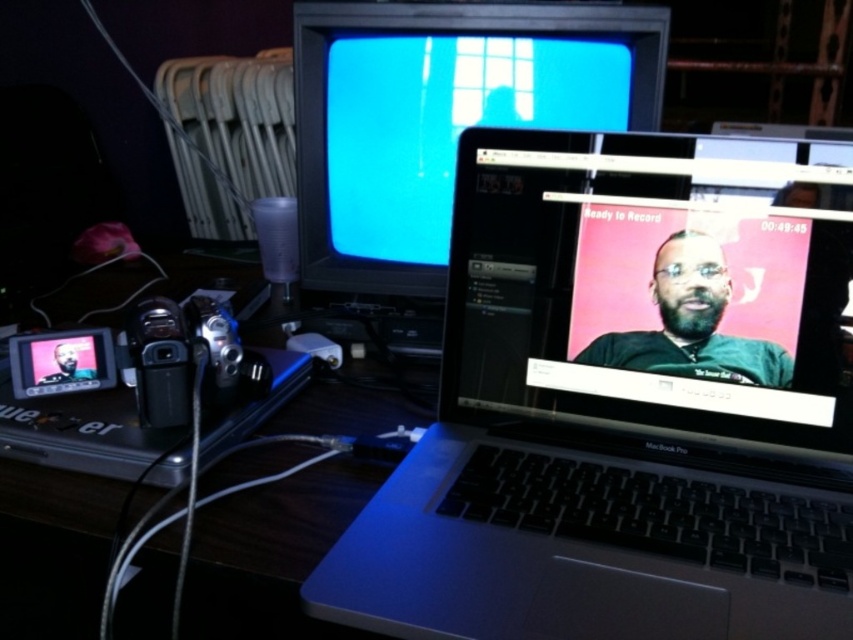
This screenshot has width=853, height=640. I want to click on sleek silver laptop at center, so click(624, 404).

Does sleek silver laptop at center appear over matte black monitor at upper center?

Actually, sleek silver laptop at center is below matte black monitor at upper center.

Identify the location of sleek silver laptop at center. The height and width of the screenshot is (640, 853). (624, 404).

Which is behind, point (468, 42) or point (154, 364)?

Positioned behind is point (468, 42).

Is point (549, 77) farther from viewer compared to point (196, 310)?

Yes.

Where is `matte black monitor at upper center`? matte black monitor at upper center is located at coordinates (440, 116).

Which is more to the right, matte black monitor at upper center or satin black camera at left?

From the viewer's perspective, matte black monitor at upper center appears more on the right side.

Does matte black monitor at upper center lie in front of satin black camera at left?

No, it is not.

You are a GUI agent. You are given a task and a screenshot of the screen. Output one action in this format:
    pyautogui.click(x=<x>, y=<y>)
    Task: Click on the matte black monitor at upper center
    The image size is (853, 640).
    Given the screenshot: What is the action you would take?
    pyautogui.click(x=440, y=116)